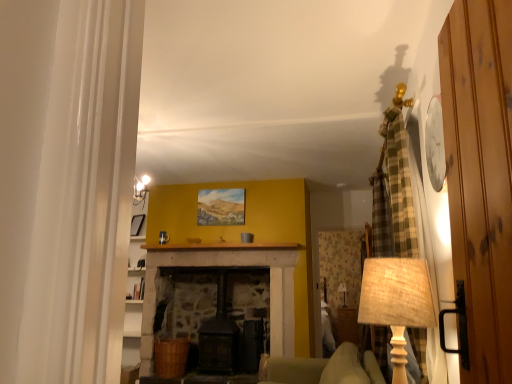
Question: Does burlap lampshade at right, the 2th table lamp when ordered from bottom to top, have a lesser height compared to matte beige lampshade at center, the 1th table lamp positioned from the bottom?

Choices:
 (A) yes
 (B) no

Answer: (B)

Question: Is burlap lampshade at right, acting as the second table lamp starting from the back, next to matte beige lampshade at center, the 1th table lamp positioned from the bottom, and touching it?

Choices:
 (A) yes
 (B) no

Answer: (B)

Question: From a real-world perspective, is burlap lampshade at right, acting as the first table lamp starting from the left, on matte beige lampshade at center, the first table lamp from the right?

Choices:
 (A) no
 (B) yes

Answer: (B)

Question: From a real-world perspective, is burlap lampshade at right, acting as the first table lamp starting from the left, positioned under matte beige lampshade at center, the first table lamp from the right, based on gravity?

Choices:
 (A) no
 (B) yes

Answer: (A)

Question: Is burlap lampshade at right, the 2th table lamp when ordered from bottom to top, not near matte beige lampshade at center, the 1th table lamp positioned from the bottom?

Choices:
 (A) yes
 (B) no

Answer: (A)

Question: Can you confirm if burlap lampshade at right, marked as the first table lamp in a top-to-bottom arrangement, is positioned to the left of matte beige lampshade at center, positioned as the 2th table lamp in top-to-bottom order?

Choices:
 (A) no
 (B) yes

Answer: (B)

Question: Is wooden door at right positioned beyond the bounds of matte black picture frame at left?

Choices:
 (A) no
 (B) yes

Answer: (B)

Question: Is wooden door at right further to the viewer compared to matte black picture frame at left?

Choices:
 (A) no
 (B) yes

Answer: (A)

Question: From the image's perspective, is wooden door at right on top of matte black picture frame at left?

Choices:
 (A) no
 (B) yes

Answer: (B)

Question: Is wooden door at right positioned in front of matte black picture frame at left?

Choices:
 (A) no
 (B) yes

Answer: (B)

Question: From the image's perspective, is wooden door at right beneath matte black picture frame at left?

Choices:
 (A) no
 (B) yes

Answer: (A)

Question: Does wooden door at right appear on the left side of matte black picture frame at left?

Choices:
 (A) yes
 (B) no

Answer: (B)

Question: Considering the relative sizes of burlap lampshade at right, marked as the first table lamp in a top-to-bottom arrangement, and matte black picture frame at left in the image provided, is burlap lampshade at right, marked as the first table lamp in a top-to-bottom arrangement, taller than matte black picture frame at left?

Choices:
 (A) yes
 (B) no

Answer: (A)